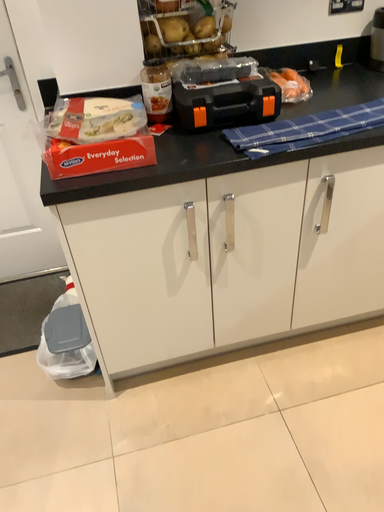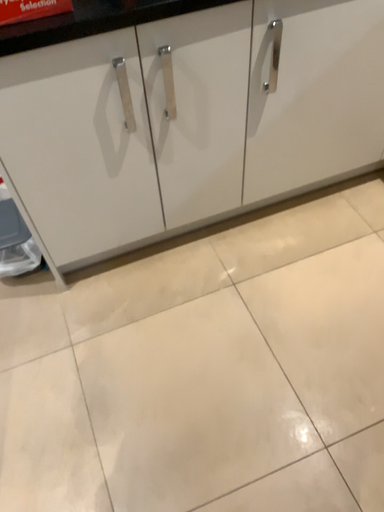
Question: Which way did the camera rotate in the video?

Choices:
 (A) rotated upward
 (B) rotated downward

Answer: (B)